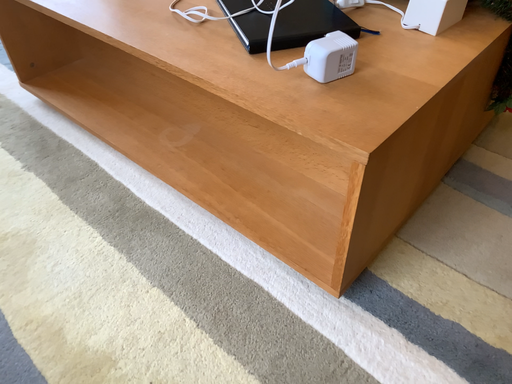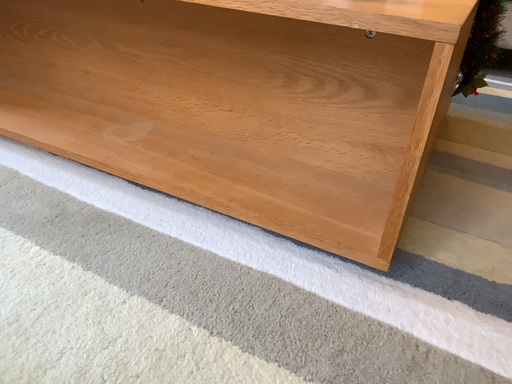
Question: Which way did the camera rotate in the video?

Choices:
 (A) rotated upward
 (B) rotated downward

Answer: (A)